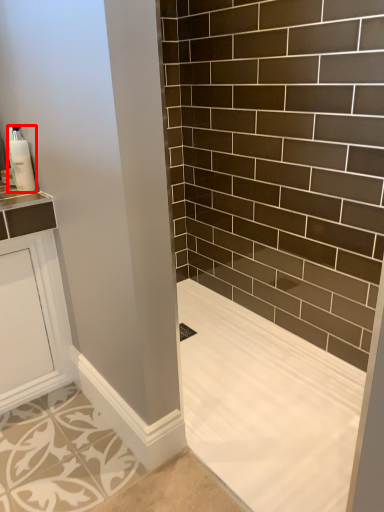
Question: Considering the relative positions of soap dispenser (annotated by the red box) and bath in the image provided, where is soap dispenser (annotated by the red box) located with respect to the staircase?

Choices:
 (A) right
 (B) left

Answer: (B)